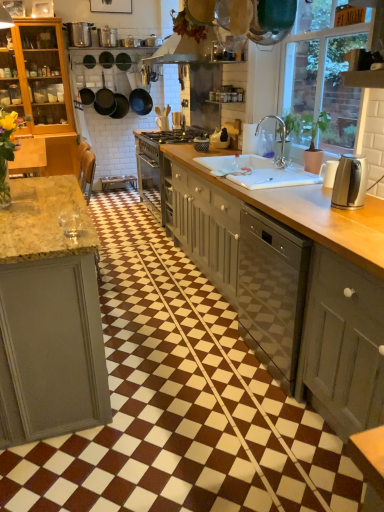
Question: Is white glossy sink at center spatially inside matte black kettle at upper center, the 3th appliance viewed from the front, or outside of it?

Choices:
 (A) outside
 (B) inside

Answer: (A)

Question: Does point (253, 172) appear closer or farther from the camera than point (215, 131)?

Choices:
 (A) closer
 (B) farther

Answer: (A)

Question: Estimate the real-world distances between objects in this image. Which object is farther from the satin silver toaster at center, which ranks as the fourth appliance in bottom-to-top order?

Choices:
 (A) matte gray cabinet at lower right
 (B) wooden at center
 (C) matte black kettle at upper center, the 2th appliance positioned from the right
 (D) silver metallic kettle at right, the 1th appliance from the front
 (E) black matte frying pan at upper left, the second frying pan viewed from the right

Answer: (A)

Question: Based on their relative distances, which object is nearer to the black matte frying pan at upper left, the second frying pan viewed from the right?

Choices:
 (A) white glossy sink at center
 (B) black matte frying pan at upper center, the 1th frying pan from the right
 (C) satin silver toaster at center, which ranks as the fourth appliance in bottom-to-top order
 (D) satin silver kettle at right
 (E) matte black kettle at upper center, the 3th appliance viewed from the front

Answer: (B)